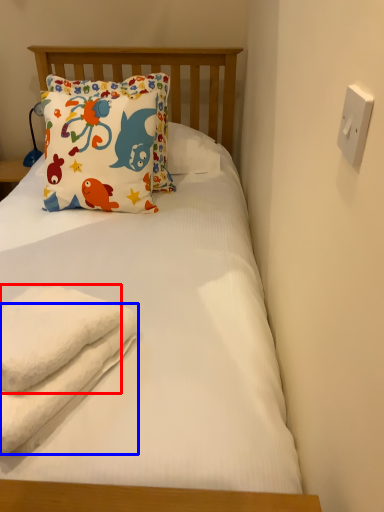
Question: Which object appears farthest to the camera in this image, towel (highlighted by a red box) or beach towel (highlighted by a blue box)?

Choices:
 (A) towel
 (B) beach towel

Answer: (A)